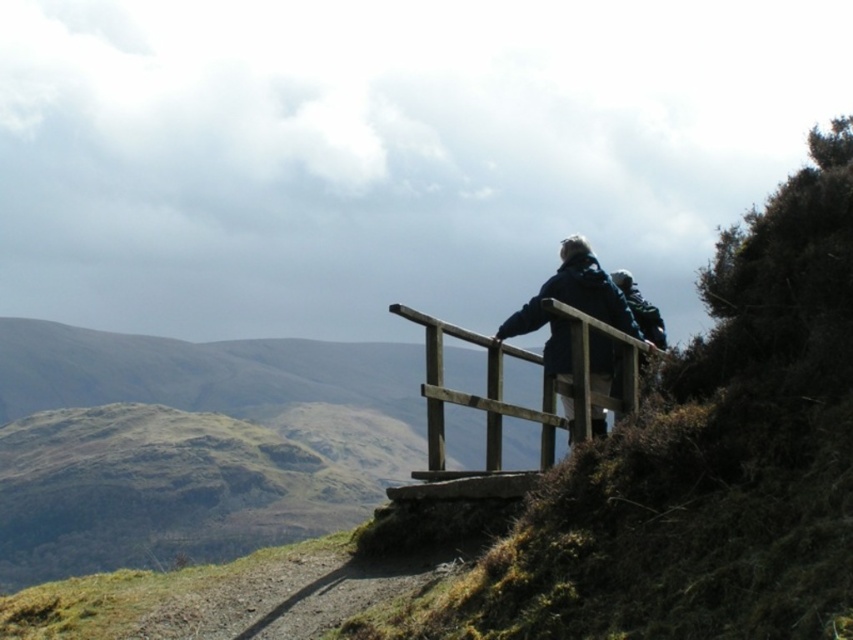
You are standing at the top of a hill and see the wooden rail at upper center and the dark blue jacket at upper center. Which object is closer to you?

The wooden rail at upper center is closer to you because it is in front of the dark blue jacket at upper center.

You are standing at the base of the slope and want to reach the wooden rail at upper center. Given that the slope has a 15 degree incline, how far will you have to walk horizontally to reach the rail?

The distance between you and the wooden rail at upper center is 8.95 meters. Using trigonometry, the horizontal distance would be 8.95 multiplied by the cosine of 15 degrees, which equals approximately 8.67 meters. Therefore, you need to walk about 8.67 meters horizontally to reach the wooden rail at upper center.